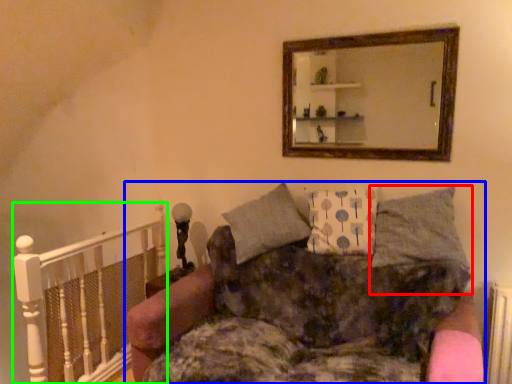
Question: Based on their relative distances, which object is nearer to pillow (highlighted by a red box)? Choose from studio couch (highlighted by a blue box) and balustrade (highlighted by a green box).

Choices:
 (A) studio couch
 (B) balustrade

Answer: (A)